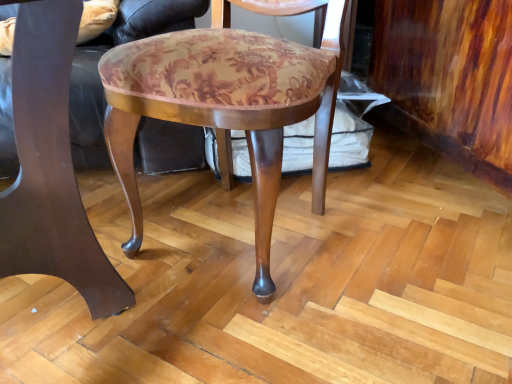
Find the location of a particular element. vacant space that's between matte brown wood chair at center, the 1th chair from the left, and wooden chair at center, marked as the second chair in a left-to-right arrangement is located at coordinates (175, 289).